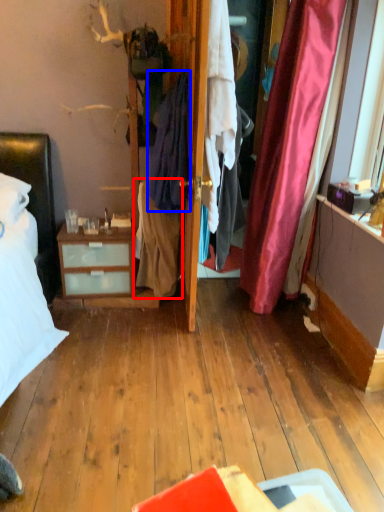
Question: Which object is closer to the camera taking this photo, clothing (highlighted by a red box) or clothing (highlighted by a blue box)?

Choices:
 (A) clothing
 (B) clothing

Answer: (B)